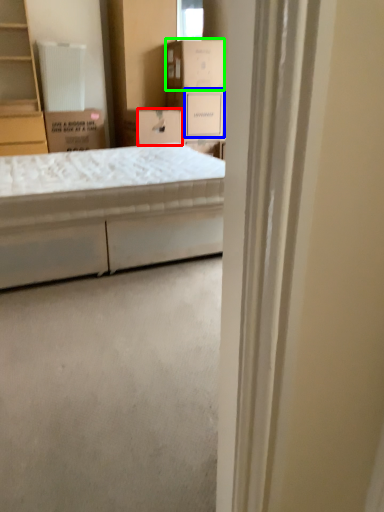
Question: Which is nearer to the storage box (highlighted by a red box)? storage box (highlighted by a blue box) or cardboard box (highlighted by a green box).

Choices:
 (A) storage box
 (B) cardboard box

Answer: (A)